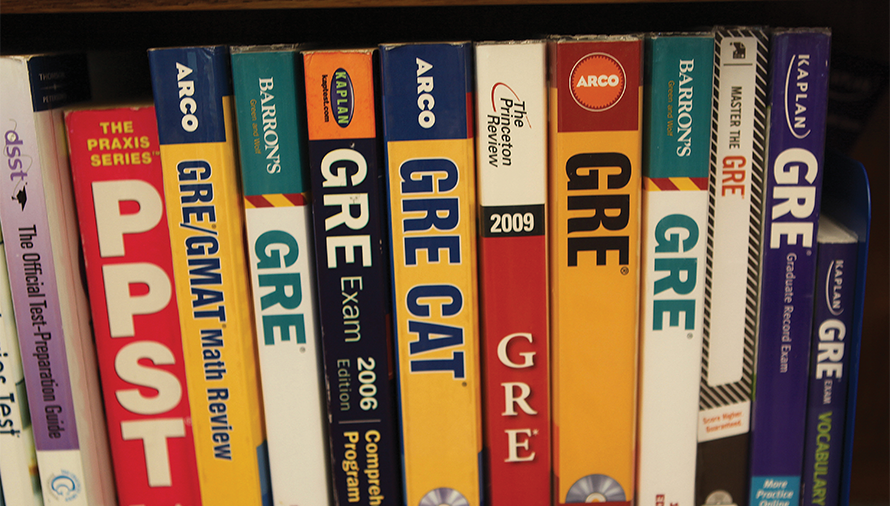
The height and width of the screenshot is (506, 890). I want to click on right book end, so click(864, 193).